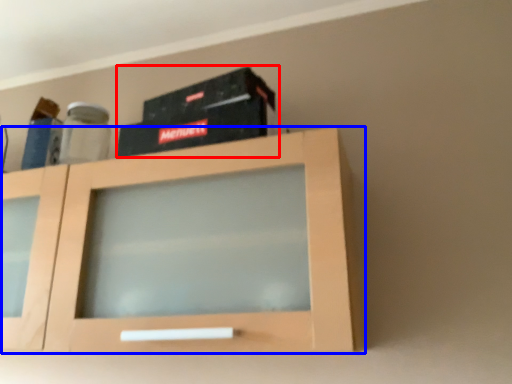
Question: Which object appears closest to the camera in this image, box (highlighted by a red box) or cabinetry (highlighted by a blue box)?

Choices:
 (A) box
 (B) cabinetry

Answer: (B)